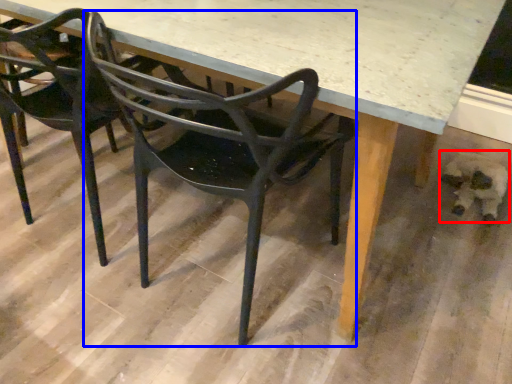
Question: Which object is further to the camera taking this photo, animal (highlighted by a red box) or chair (highlighted by a blue box)?

Choices:
 (A) animal
 (B) chair

Answer: (A)